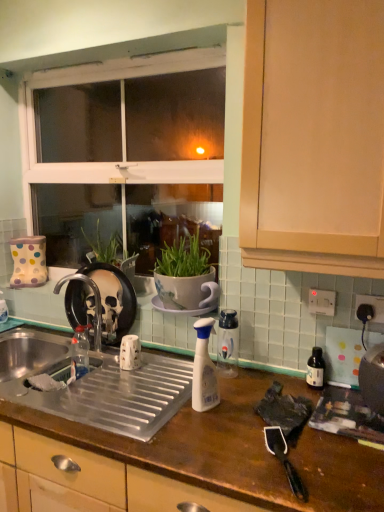
Question: Looking at the image, does white plastic electric outlet at upper right, marked as the first electric outlet in a back-to-front arrangement, seem bigger or smaller compared to metallic stainless steel kettle at right, the second appliance positioned from the left?

Choices:
 (A) big
 (B) small

Answer: (B)

Question: In the image, is white plastic electric outlet at upper right, the second electric outlet positioned from the front, positioned in front of or behind metallic stainless steel kettle at right, the 1th appliance viewed from the front?

Choices:
 (A) behind
 (B) front

Answer: (A)

Question: Estimate the real-world distances between objects in this image. Which object is farther from the translucent plastic bottle at sink, acting as the 1th bottle starting from the left?

Choices:
 (A) transparent plastic spray bottle at center, which is counted as the 2th bottle, starting from the back
 (B) brown wooden countertop at center
 (C) metallic stainless steel kettle at right, placed as the second appliance when sorted from top to bottom
 (D) matte wood cabinet at upper right
 (E) white plastic electric outlet at upper right, marked as the first electric outlet in a back-to-front arrangement

Answer: (D)

Question: Which is farther from the translucent plastic bottle at sink, acting as the 1th bottle starting from the left?

Choices:
 (A) black matte faucet at sink left
 (B) transparent plastic spray bottle at center, which is the 3th bottle from left to right
 (C) polka dot ceramic boot at left, placed as the 2th appliance when sorted from bottom to top
 (D) metallic stainless steel kettle at right, the first appliance from the right
 (E) black glass bottle at right, marked as the 2th bottle in a front-to-back arrangement

Answer: (D)